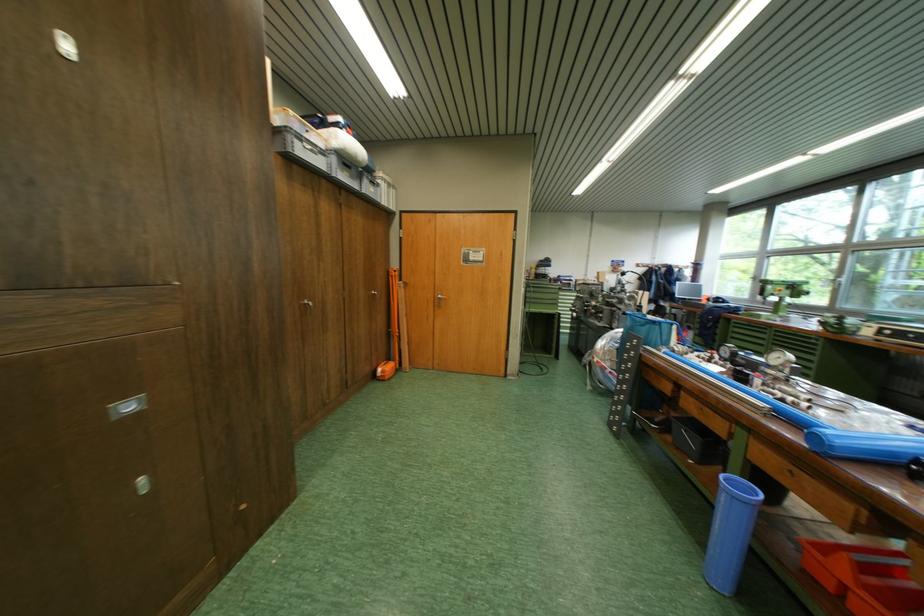
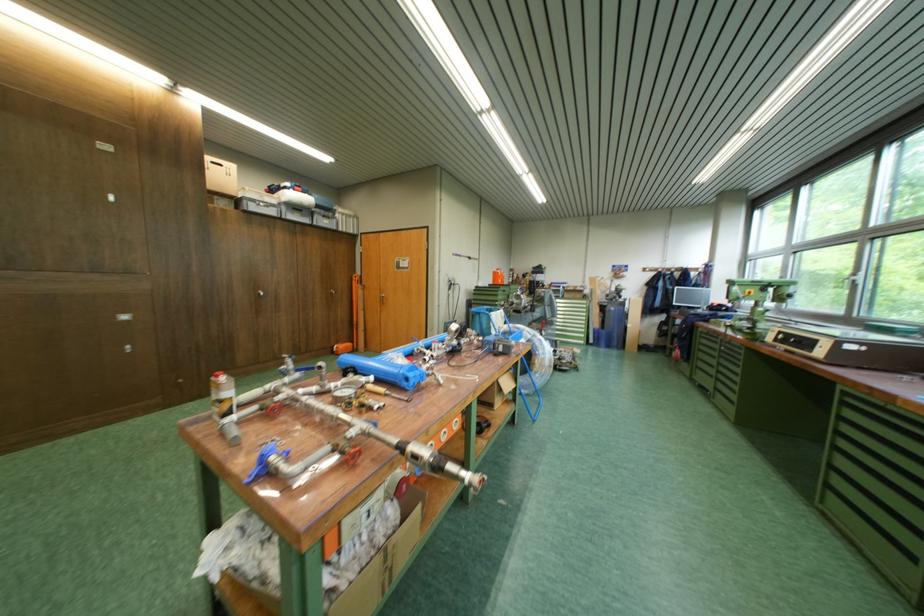
In the second image, find the point that corresponds to (115,416) in the first image.

(127, 321)